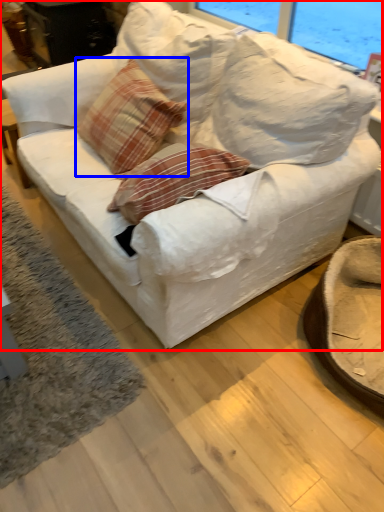
Question: Which object is closer to the camera taking this photo, studio couch (highlighted by a red box) or throw pillow (highlighted by a blue box)?

Choices:
 (A) studio couch
 (B) throw pillow

Answer: (A)